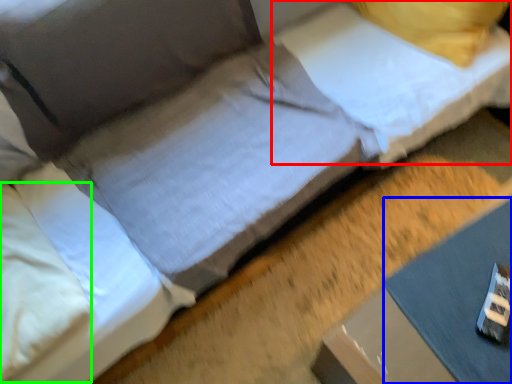
Question: Which is farther away from pillow (highlighted by a red box)? sheet (highlighted by a blue box) or pillow (highlighted by a green box)?

Choices:
 (A) sheet
 (B) pillow

Answer: (B)